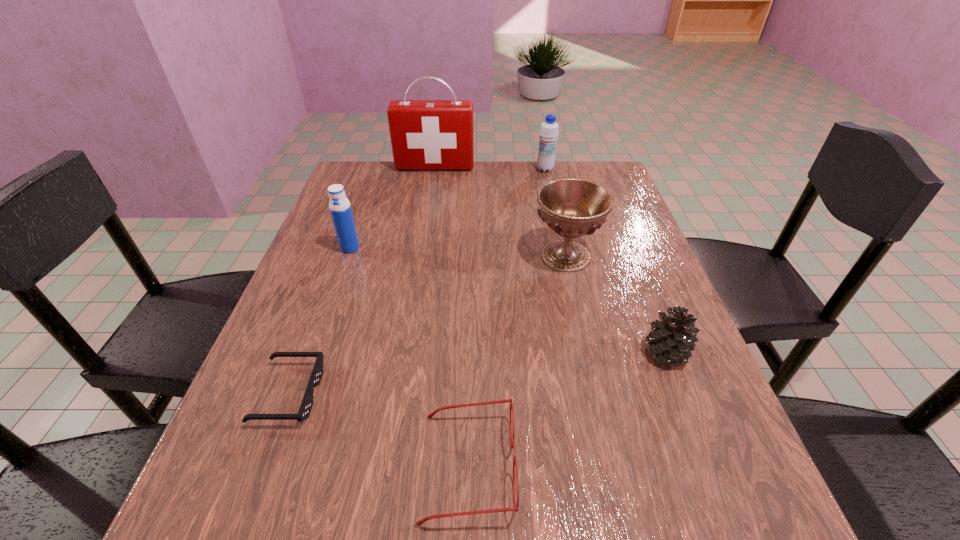
Find the location of a particular element. Image resolution: width=960 pixels, height=540 pixels. vacant space situated 0.290m on the back of the left water bottle is located at coordinates (373, 182).

Where is `free location located on the right of the chalice`? The width and height of the screenshot is (960, 540). free location located on the right of the chalice is located at coordinates (641, 256).

This screenshot has height=540, width=960. Identify the location of vacant space located on the back of the fifth tallest object. (635, 274).

This screenshot has height=540, width=960. I want to click on vacant space positioned on the face of the sixth tallest object, so click(612, 465).

Image resolution: width=960 pixels, height=540 pixels. Identify the location of vacant region located on the front-facing side of the shortest object. (449, 393).

This screenshot has width=960, height=540. In order to click on the first-aid kit present at the far edge in this screenshot , I will do `click(425, 134)`.

Identify the location of water bottle positioned at the far edge. The width and height of the screenshot is (960, 540). (549, 130).

The width and height of the screenshot is (960, 540). Find the location of `object that is at the near edge`. object that is at the near edge is located at coordinates (431, 415).

You are a GUI agent. You are given a task and a screenshot of the screen. Output one action in this format:
    pyautogui.click(x=<x>, y=<y>)
    Task: Click on the first-aid kit situated at the left edge
    
    Given the screenshot: What is the action you would take?
    pyautogui.click(x=425, y=134)

This screenshot has width=960, height=540. I want to click on water bottle located in the left edge section of the desktop, so tap(340, 208).